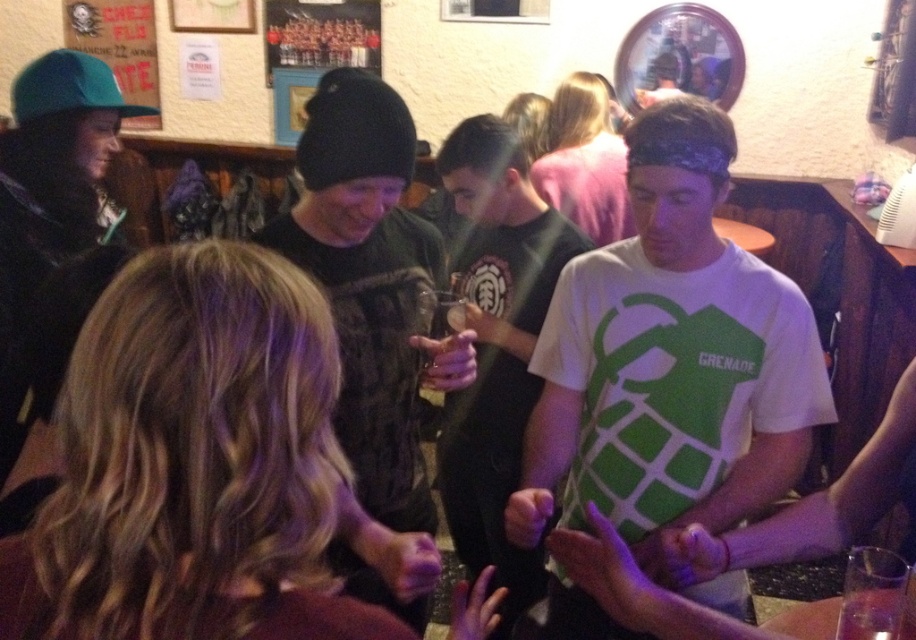
Question: In this image, where is white matte t-shirt at center located relative to transparent plastic cup at lower right?

Choices:
 (A) right
 (B) left

Answer: (B)

Question: Among these points, which one is nearest to the camera?

Choices:
 (A) (845, 632)
 (B) (368, 253)
 (C) (455, 200)
 (D) (773, 342)

Answer: (A)

Question: Observing the image, what is the correct spatial positioning of black knit cap at center in reference to transparent plastic cup at lower right?

Choices:
 (A) below
 (B) above

Answer: (B)

Question: In this image, where is black knit cap at center located relative to dark green t-shirt at center?

Choices:
 (A) below
 (B) above

Answer: (B)

Question: Which object is closer to the camera taking this photo?

Choices:
 (A) transparent plastic cup at lower right
 (B) dark green t-shirt at center

Answer: (A)

Question: Which point appears closest to the camera in this image?

Choices:
 (A) (830, 408)
 (B) (851, 604)
 (C) (315, 120)
 (D) (529, 317)

Answer: (B)